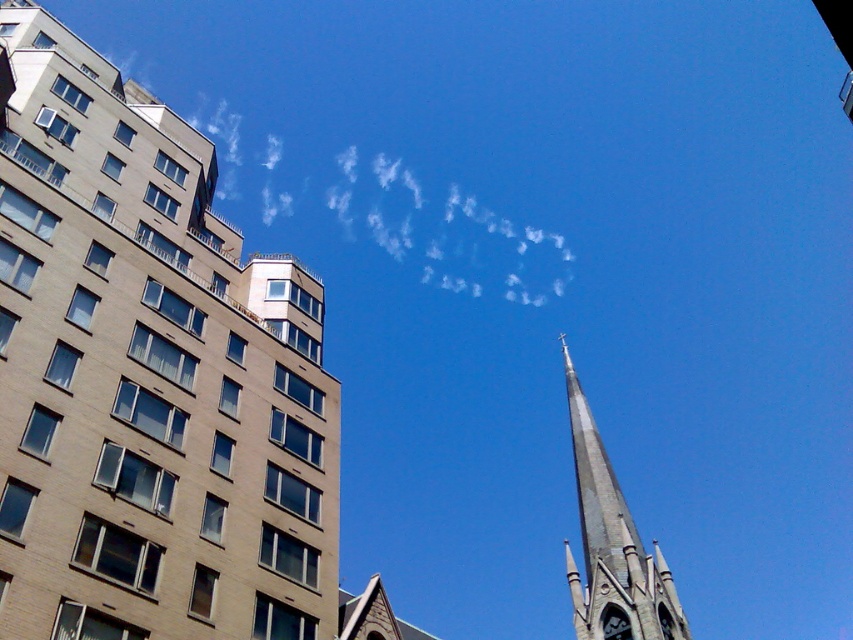
Question: Which of the following is the closest to the observer?

Choices:
 (A) (612, 637)
 (B) (614, 506)
 (C) (30, 8)

Answer: (C)

Question: Is the position of gray stone spire at center less distant than that of gray stone steeple at center?

Choices:
 (A) yes
 (B) no

Answer: (A)

Question: Is gray stone spire at center above gray stone steeple at center?

Choices:
 (A) yes
 (B) no

Answer: (A)

Question: Is gray stone spire at center positioned at the back of black glossy clock at upper center?

Choices:
 (A) yes
 (B) no

Answer: (B)

Question: Among these points, which one is farthest from the camera?

Choices:
 (A) (27, 548)
 (B) (624, 625)
 (C) (634, 621)

Answer: (B)

Question: Which object is positioned farthest from the gray stone spire at center?

Choices:
 (A) gray stone steeple at center
 (B) black glossy clock at upper center

Answer: (A)